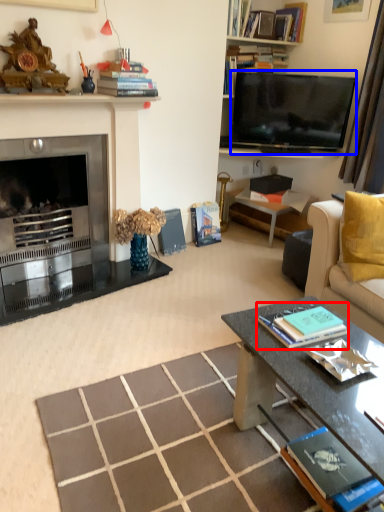
Question: Which object is closer to the camera taking this photo, book (highlighted by a red box) or television (highlighted by a blue box)?

Choices:
 (A) book
 (B) television

Answer: (A)